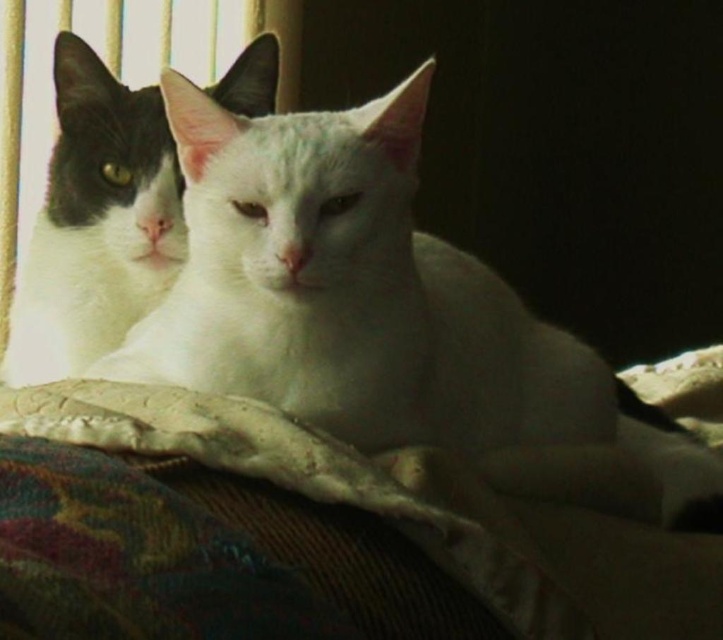
Question: Is white soft fur cat at center bigger than black and white fur cat at left?

Choices:
 (A) no
 (B) yes

Answer: (B)

Question: Which point is closer to the camera taking this photo?

Choices:
 (A) (85, 93)
 (B) (290, 200)

Answer: (B)

Question: Does white soft fur cat at center appear over black and white fur cat at left?

Choices:
 (A) yes
 (B) no

Answer: (B)

Question: Can you confirm if white soft fur cat at center is positioned above black and white fur cat at left?

Choices:
 (A) yes
 (B) no

Answer: (B)

Question: Among these points, which one is farthest from the camera?

Choices:
 (A) (502, 417)
 (B) (137, 170)

Answer: (B)